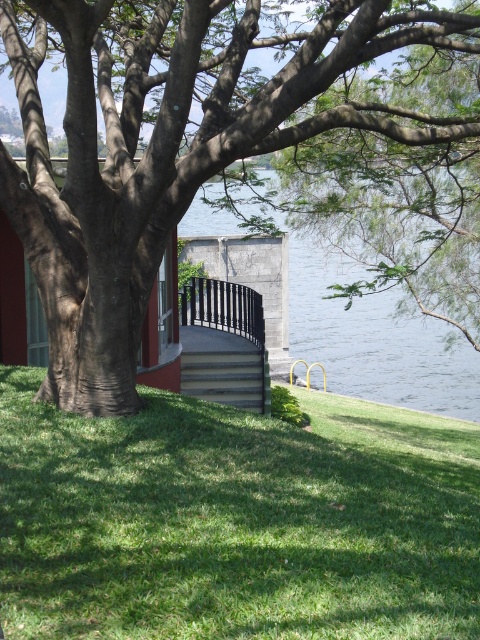
You are standing at the point marked by point (x=236, y=520) in the image. What is the terrain like under your feet?

The terrain under your feet is green grass at lower center.

You are standing in the outdoor scene and want to walk from the brown rough tree at center to the water edge. Which direction should you head relative to the green grass at lower center?

To reach the water edge from the brown rough tree at center, you should head to the left side of the green grass at lower center since the green grass at lower center is on the right side of the brown rough tree at center.

You are standing at the edge of the water and want to climb up to the gray concrete stairs at lower center. Based on their position, can you estimate how far you need to walk horizontally to reach them?

The gray concrete stairs at lower center are located at coordinates point (228,378), so you would need to walk approximately 0.591 units horizontally to reach them.